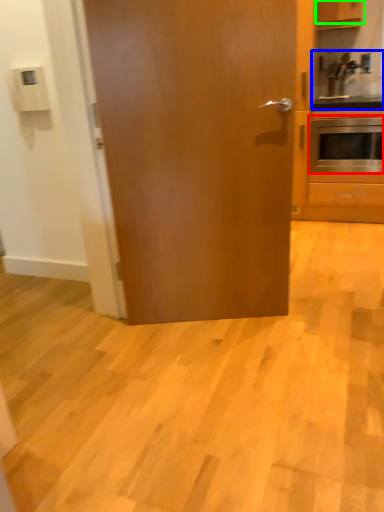
Question: Which is farther away from oven (highlighted by a red box)? sink (highlighted by a blue box) or cabinetry (highlighted by a green box)?

Choices:
 (A) sink
 (B) cabinetry

Answer: (B)